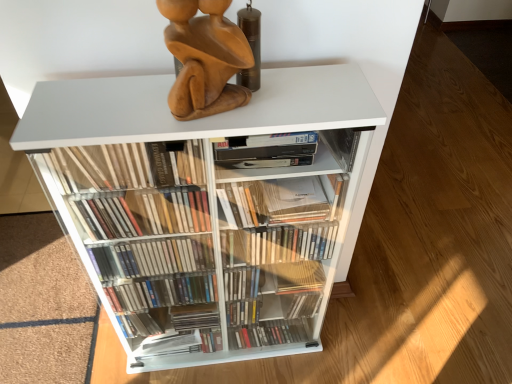
The width and height of the screenshot is (512, 384). Describe the element at coordinates (204, 208) in the screenshot. I see `white plastic bookcase at center` at that location.

Find the location of a particular element. This screenshot has height=384, width=512. white plastic bookcase at center is located at coordinates (204, 208).

I want to click on white plastic bookcase at center, so click(x=204, y=208).